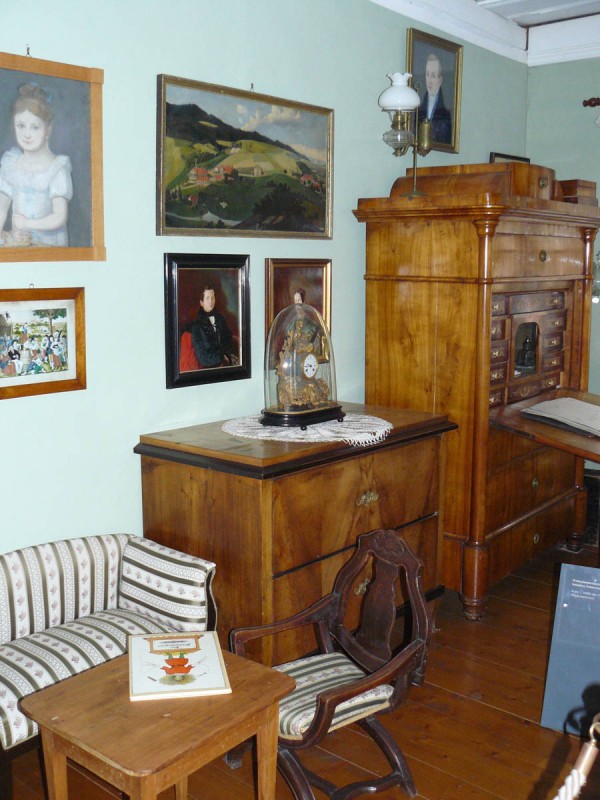
Locate an element on the screen. Image resolution: width=600 pixels, height=800 pixels. painting is located at coordinates (67, 164), (273, 160), (58, 354), (236, 330), (291, 294), (432, 90).